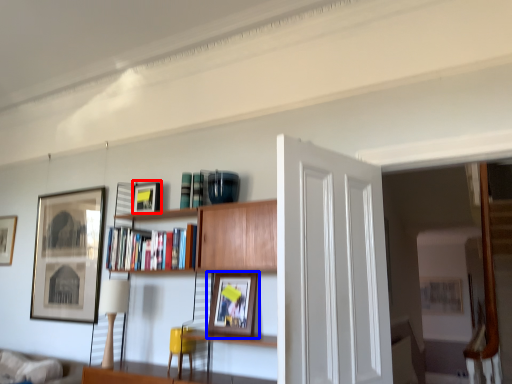
Question: Which object is further to the camera taking this photo, picture frame (highlighted by a red box) or picture frame (highlighted by a blue box)?

Choices:
 (A) picture frame
 (B) picture frame

Answer: (A)